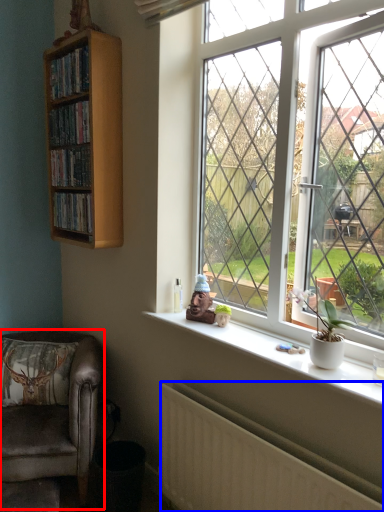
Question: Which of the following is the farthest to the observer, chair (highlighted by a red box) or radiator (highlighted by a blue box)?

Choices:
 (A) chair
 (B) radiator

Answer: (A)